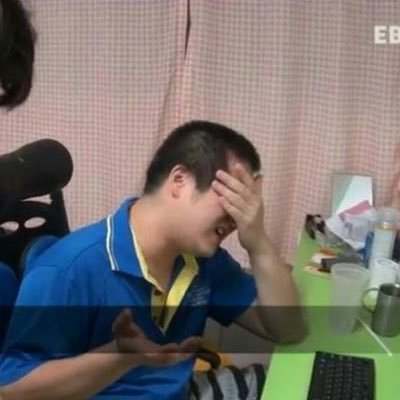
Identify the location of mirror. The width and height of the screenshot is (400, 400). (355, 191).